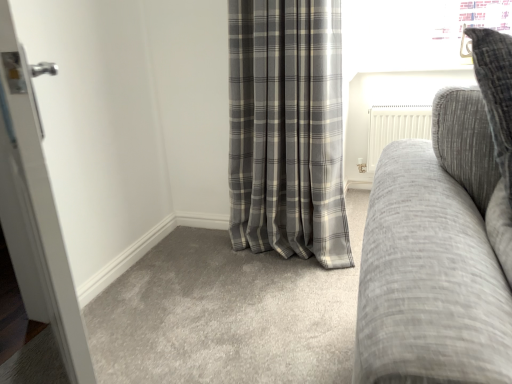
Question: Considering their positions, is gray plaid curtain at center located in front of or behind textured gray couch at right?

Choices:
 (A) front
 (B) behind

Answer: (B)

Question: Is gray plaid curtain at center spatially inside textured gray couch at right, or outside of it?

Choices:
 (A) outside
 (B) inside

Answer: (A)

Question: Estimate the real-world distances between objects in this image. Which object is farther from the white glossy door at left?

Choices:
 (A) textured gray couch at right
 (B) gray plaid curtain at center

Answer: (B)

Question: Based on their relative distances, which object is nearer to the gray plaid curtain at center?

Choices:
 (A) white glossy door at left
 (B) textured gray couch at right

Answer: (A)